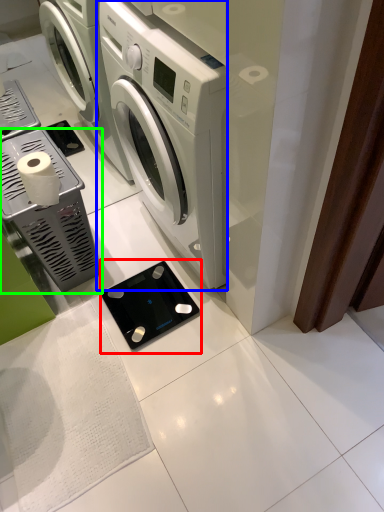
Question: Which object is positioned farthest from appliance (highlighted by a red box)? Select from washing machine (highlighted by a blue box) and appliance (highlighted by a green box).

Choices:
 (A) washing machine
 (B) appliance

Answer: (A)